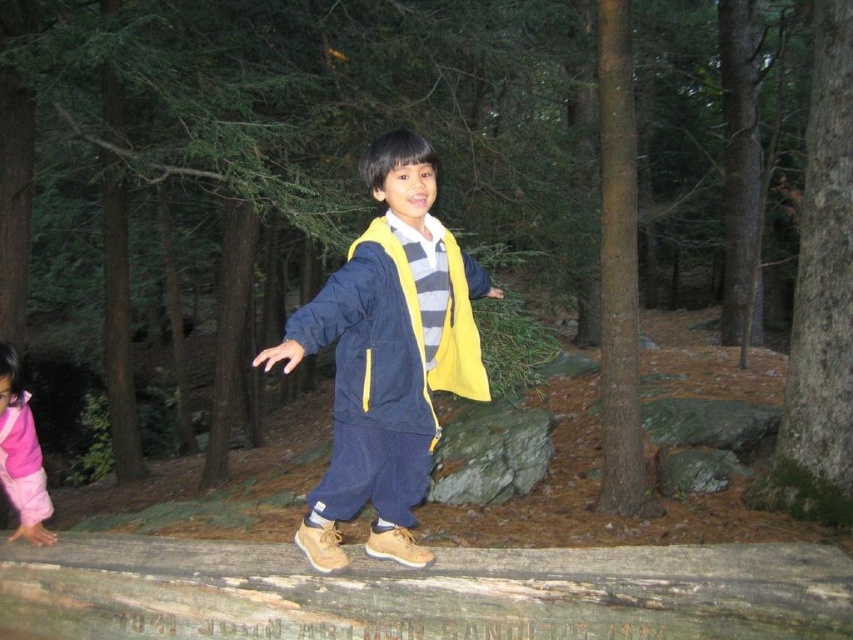
Question: Which point is closer to the camera?

Choices:
 (A) matte blue jacket at center
 (B) weathered wooden log at center

Answer: (A)

Question: Which object appears farthest from the camera in this image?

Choices:
 (A) navy blue/yellow fabric jacket at center
 (B) pink fleece pants at lower left
 (C) matte blue jacket at center

Answer: (B)

Question: Does navy blue/yellow fabric jacket at center have a greater width compared to pink fleece pants at lower left?

Choices:
 (A) yes
 (B) no

Answer: (B)

Question: From the image, what is the correct spatial relationship of matte blue jacket at center in relation to navy blue/yellow fabric jacket at center?

Choices:
 (A) left
 (B) right

Answer: (A)

Question: Does brown rough bark tree trunk at center-right appear over pink fleece pants at lower left?

Choices:
 (A) no
 (B) yes

Answer: (B)

Question: Based on their relative distances, which object is farther from the matte blue jacket at center?

Choices:
 (A) weathered wooden log at center
 (B) navy blue/yellow fabric jacket at center

Answer: (A)